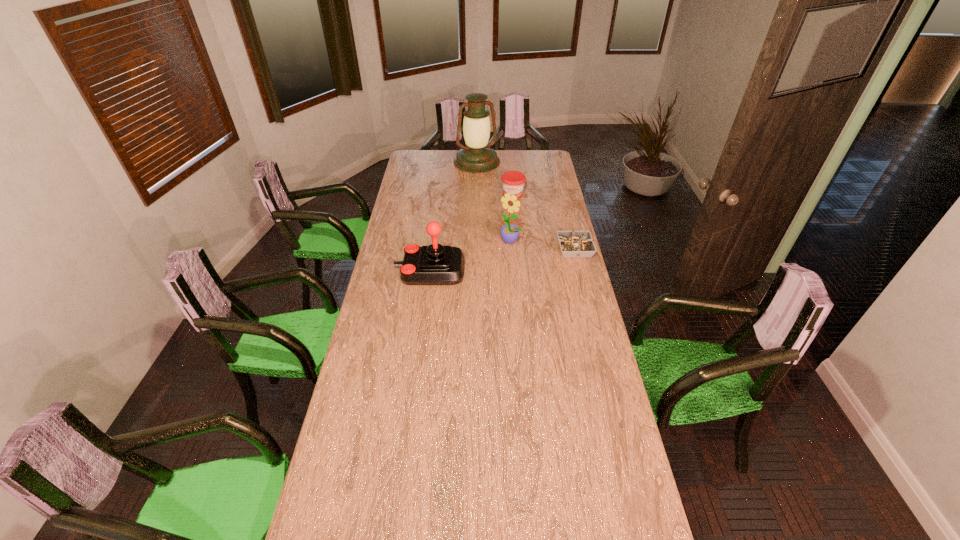
Find the location of a particular element. This screenshot has height=540, width=960. object situated at the far edge is located at coordinates (476, 157).

You are a GUI agent. You are given a task and a screenshot of the screen. Output one action in this format:
    pyautogui.click(x=<x>, y=<y>)
    Task: Click on the object that is at the left edge
    
    Given the screenshot: What is the action you would take?
    pyautogui.click(x=435, y=264)

Find the location of `object that is positioned at the right edge`. object that is positioned at the right edge is located at coordinates (578, 244).

The image size is (960, 540). In the image, there is a desktop. In order to click on vacant space at the far edge in this screenshot , I will do `click(440, 150)`.

Identify the location of free space at the near edge of the desktop. (570, 489).

Locate an element on the screen. This screenshot has height=540, width=960. vacant space at the left edge is located at coordinates (372, 356).

At what (x,y) coordinates should I click in order to perform the action: click on free space at the right edge of the desktop. Please return your answer as a coordinate pair (x, y). This screenshot has height=540, width=960. Looking at the image, I should click on (552, 217).

Where is `vacant space at the far right corner of the desktop`? vacant space at the far right corner of the desktop is located at coordinates (530, 153).

This screenshot has height=540, width=960. Find the location of `free spot at the near right corner of the desktop`. free spot at the near right corner of the desktop is located at coordinates (586, 489).

Locate an element on the screen. blank region between the joystick and the fourth nearest object is located at coordinates (471, 232).